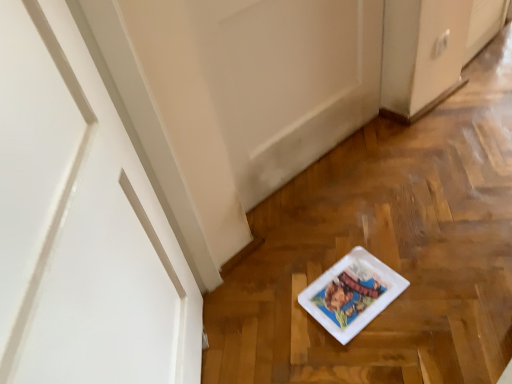
Question: In the image, is white matte door at center on the left side or the right side of white glossy platter at center?

Choices:
 (A) right
 (B) left

Answer: (B)

Question: Considering their positions, is white matte door at center located in front of or behind white glossy platter at center?

Choices:
 (A) front
 (B) behind

Answer: (A)

Question: Would you say white matte door at center is inside or outside white glossy platter at center?

Choices:
 (A) outside
 (B) inside

Answer: (A)

Question: Looking at the image, does white glossy platter at center seem bigger or smaller compared to white matte door at center?

Choices:
 (A) big
 (B) small

Answer: (B)

Question: From a real-world perspective, is white glossy platter at center positioned above or below white matte door at center?

Choices:
 (A) below
 (B) above

Answer: (A)

Question: Looking at their shapes, would you say white glossy platter at center is wider or thinner than white matte door at center?

Choices:
 (A) thin
 (B) wide

Answer: (B)

Question: Is white glossy platter at center in front of or behind white matte door at center in the image?

Choices:
 (A) front
 (B) behind

Answer: (B)